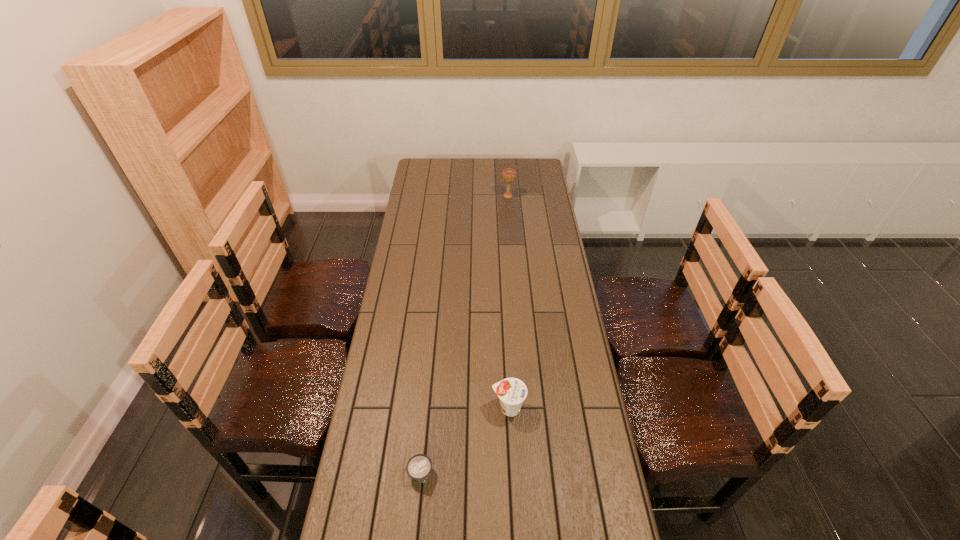
Locate an element on the screen. Image resolution: width=960 pixels, height=540 pixels. vacant space that's between the shortest object and the farthest object is located at coordinates (x=465, y=335).

Find the location of `empty location between the farthest object and the nearer yogurt`. empty location between the farthest object and the nearer yogurt is located at coordinates (465, 335).

Where is `free spot between the farthest object and the farther yogurt`? free spot between the farthest object and the farther yogurt is located at coordinates (508, 302).

The width and height of the screenshot is (960, 540). Identify the location of free area in between the nearest object and the taller yogurt. (465, 441).

Locate which object ranks second in proximity to the second farthest object. Please provide its 2D coordinates. Your answer should be formatted as a tuple, i.e. [(x, y)], where the tuple contains the x and y coordinates of a point satisfying the conditions above.

[(508, 175)]

Select which object appears as the second closest to the farther yogurt. Please provide its 2D coordinates. Your answer should be formatted as a tuple, i.e. [(x, y)], where the tuple contains the x and y coordinates of a point satisfying the conditions above.

[(508, 175)]

I want to click on free point that satisfies the following two spatial constraints: 1. on the back side of the shorter yogurt; 2. on the right side of the farthest object, so click(447, 196).

Where is `vacant space that satisfies the following two spatial constraints: 1. on the back side of the nearest object; 2. on the right side of the right yogurt`? This screenshot has width=960, height=540. vacant space that satisfies the following two spatial constraints: 1. on the back side of the nearest object; 2. on the right side of the right yogurt is located at coordinates (427, 408).

Identify the location of vacant space that satisfies the following two spatial constraints: 1. on the back side of the right yogurt; 2. on the right side of the tallest object. (497, 196).

Identify the location of free space that satisfies the following two spatial constraints: 1. on the back side of the nearer yogurt; 2. on the left side of the second nearest object. This screenshot has height=540, width=960. 427,408.